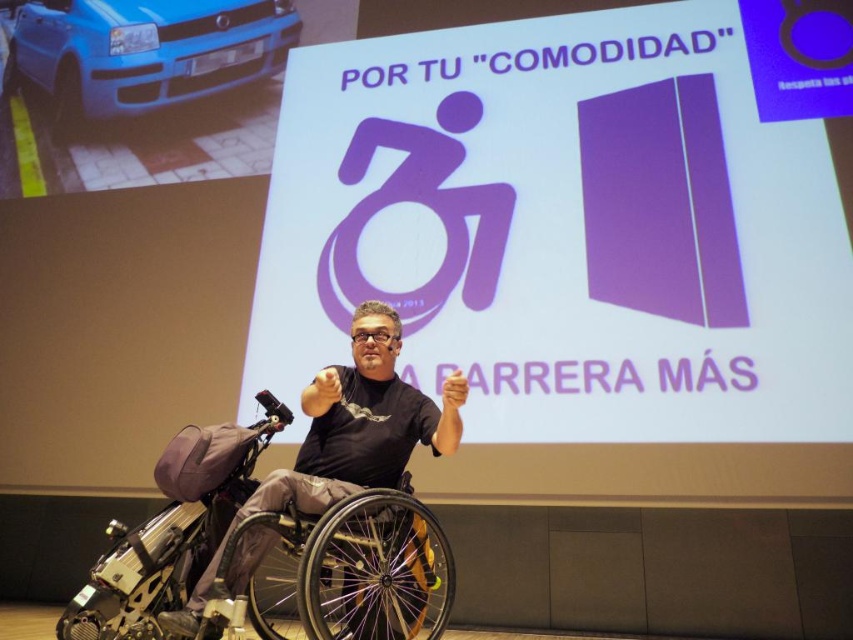
Question: Among these objects, which one is nearest to the camera?

Choices:
 (A) purple matte projection screen at upper center
 (B) silver metallic wheelchair at center
 (C) blue matte car at upper left

Answer: (B)

Question: From the image, what is the correct spatial relationship of purple matte projection screen at upper center in relation to silver metallic wheelchair at center?

Choices:
 (A) above
 (B) below

Answer: (A)

Question: Does purple matte projection screen at upper center have a greater width compared to silver metallic wheelchair at center?

Choices:
 (A) no
 (B) yes

Answer: (B)

Question: Which of the following is the farthest from the observer?

Choices:
 (A) (274, 68)
 (B) (349, 292)

Answer: (A)

Question: Does silver metallic wheelchair at center appear on the right side of blue matte car at upper left?

Choices:
 (A) no
 (B) yes

Answer: (B)

Question: Which object is positioned closest to the blue matte car at upper left?

Choices:
 (A) silver metallic wheelchair at center
 (B) purple matte projection screen at upper center

Answer: (B)